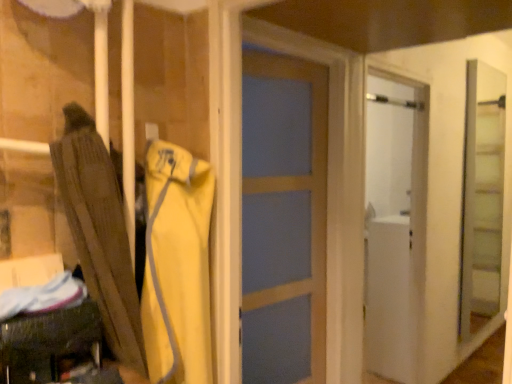
Question: Considering the relative sizes of clear glass screen door at right and brown fabric umbrella at left in the image provided, is clear glass screen door at right bigger than brown fabric umbrella at left?

Choices:
 (A) yes
 (B) no

Answer: (A)

Question: Is clear glass screen door at right taller than brown fabric umbrella at left?

Choices:
 (A) no
 (B) yes

Answer: (B)

Question: Is clear glass screen door at right to the left of brown fabric umbrella at left from the viewer's perspective?

Choices:
 (A) no
 (B) yes

Answer: (A)

Question: Could you tell me if clear glass screen door at right is turned towards brown fabric umbrella at left?

Choices:
 (A) yes
 (B) no

Answer: (B)

Question: From the image's perspective, would you say clear glass screen door at right is positioned over brown fabric umbrella at left?

Choices:
 (A) no
 (B) yes

Answer: (B)

Question: Relative to white matte refrigerator at right, is brown fabric umbrella at left in front or behind?

Choices:
 (A) behind
 (B) front

Answer: (B)

Question: Is brown fabric umbrella at left inside or outside of white matte refrigerator at right?

Choices:
 (A) inside
 (B) outside

Answer: (B)

Question: In terms of size, does brown fabric umbrella at left appear bigger or smaller than white matte refrigerator at right?

Choices:
 (A) small
 (B) big

Answer: (A)

Question: Considering the positions of point (144, 370) and point (384, 198), is point (144, 370) closer or farther from the camera than point (384, 198)?

Choices:
 (A) farther
 (B) closer

Answer: (B)

Question: Does point (196, 248) appear closer or farther from the camera than point (96, 137)?

Choices:
 (A) farther
 (B) closer

Answer: (A)

Question: Is yellow fabric jacket at center bigger or smaller than brown fabric umbrella at left?

Choices:
 (A) big
 (B) small

Answer: (B)

Question: In terms of width, does yellow fabric jacket at center look wider or thinner when compared to brown fabric umbrella at left?

Choices:
 (A) wide
 (B) thin

Answer: (B)

Question: In terms of height, does yellow fabric jacket at center look taller or shorter compared to brown fabric umbrella at left?

Choices:
 (A) tall
 (B) short

Answer: (B)

Question: From the image's perspective, is white matte refrigerator at right located above or below yellow fabric jacket at center?

Choices:
 (A) above
 (B) below

Answer: (B)

Question: Looking at the image, does white matte refrigerator at right seem bigger or smaller compared to yellow fabric jacket at center?

Choices:
 (A) small
 (B) big

Answer: (B)